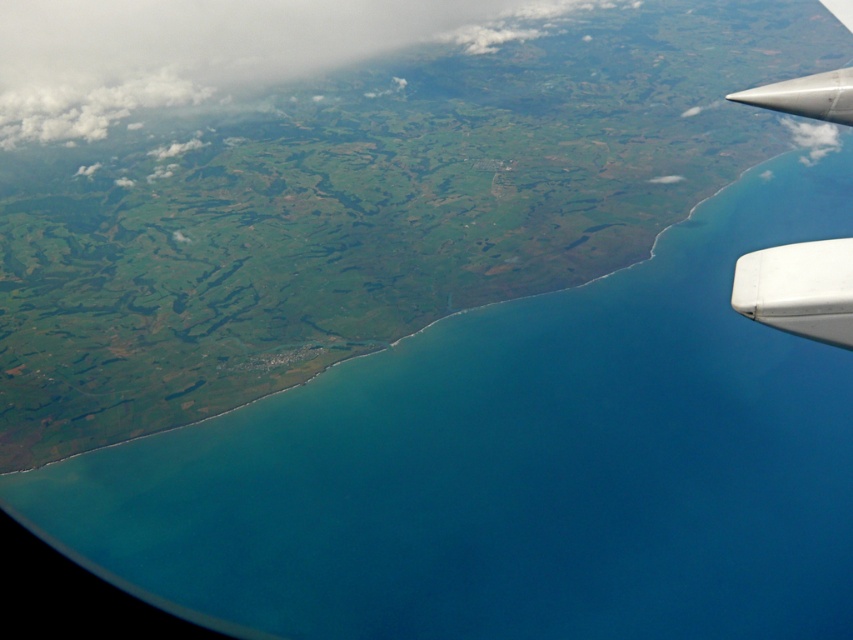
Does point (234, 74) lie in front of point (750, 268)?

No.

Find the location of `white fluffy cloud at upper left`. white fluffy cloud at upper left is located at coordinates (213, 51).

Is the position of silver metallic winglet at upper right more distant than that of white matte wing at lower right?

Yes, it is behind white matte wing at lower right.

In the scene shown: Can you confirm if silver metallic winglet at upper right is positioned to the left of white matte wing at lower right?

In fact, silver metallic winglet at upper right is to the right of white matte wing at lower right.

Between point (840, 346) and point (759, 282), which one is positioned in front?

Point (759, 282) is more forward.

Where is `silver metallic winglet at upper right`? The width and height of the screenshot is (853, 640). silver metallic winglet at upper right is located at coordinates (799, 289).

The image size is (853, 640). Describe the element at coordinates (213, 51) in the screenshot. I see `white fluffy cloud at upper left` at that location.

What do you see at coordinates (213, 51) in the screenshot? This screenshot has width=853, height=640. I see `white fluffy cloud at upper left` at bounding box center [213, 51].

I want to click on white fluffy cloud at upper left, so click(x=213, y=51).